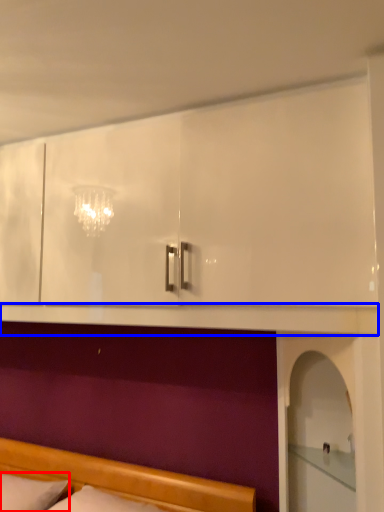
Question: Which object is further to the camera taking this photo, pillow (highlighted by a red box) or mantle (highlighted by a blue box)?

Choices:
 (A) pillow
 (B) mantle

Answer: (A)